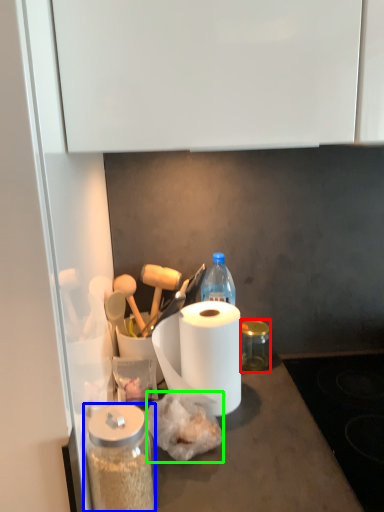
Question: Which object is positioned closest to glass jar (highlighted by a red box)? Select from glass jar (highlighted by a blue box) and food (highlighted by a green box).

Choices:
 (A) glass jar
 (B) food

Answer: (B)